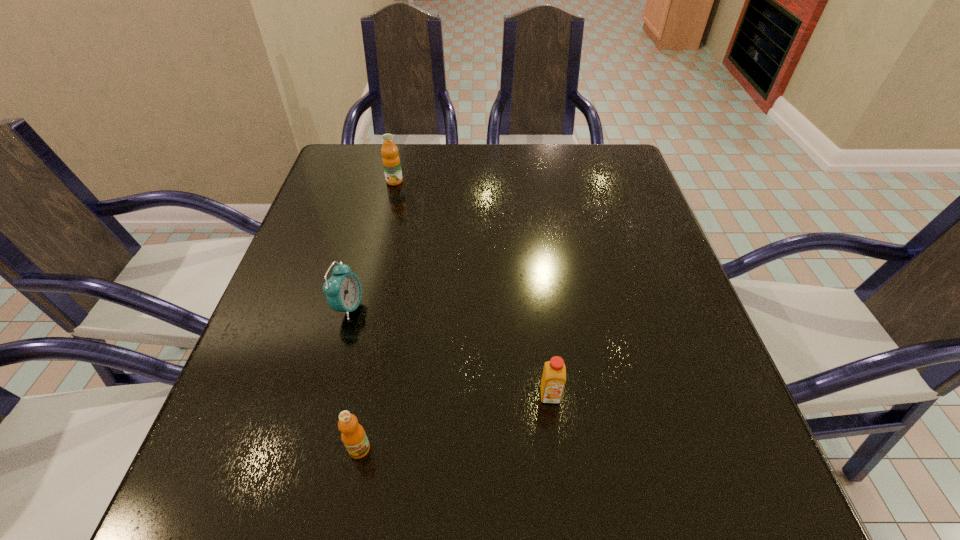
Locate an element on the screen. the farthest orange juice is located at coordinates (391, 162).

The image size is (960, 540). I want to click on the tallest orange juice, so click(x=391, y=162).

This screenshot has width=960, height=540. Find the location of `the second farthest object`. the second farthest object is located at coordinates (343, 290).

Identify the location of the second orange juice from left to right. (353, 435).

This screenshot has width=960, height=540. Identify the location of the nearest object. (353, 435).

This screenshot has height=540, width=960. Identify the location of the rightmost object. (554, 374).

Locate an element on the screen. the rightmost orange juice is located at coordinates (554, 374).

Identify the location of free location located on the label of the farthest object. (387, 213).

Locate an element on the screen. The height and width of the screenshot is (540, 960). vacant space situated on the face of the alarm clock is located at coordinates (514, 307).

You are a GUI agent. You are given a task and a screenshot of the screen. Output one action in this format:
    pyautogui.click(x=<x>, y=<y>)
    Task: Click on the free region located 0.070m on the front label of the nearest object
    The height and width of the screenshot is (540, 960).
    Given the screenshot: What is the action you would take?
    pyautogui.click(x=348, y=512)